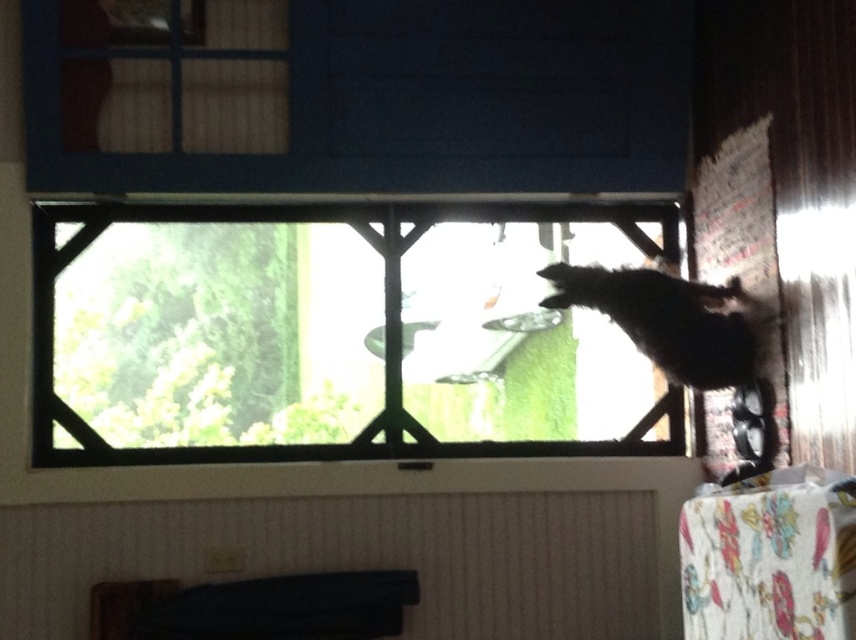
You are an interior designer assessing the space through the window. You notice the black fabric at lower center and the white paper at right. Which object takes up more area in the scene?

The white paper at right takes up more area than the black fabric at lower center.

You are an interior designer assessing the room layout. You need to determine if the black fabric at lower center can be placed under the clear glass window at center without blocking the view. Based on their sizes, can it be done?

The clear glass window at center is taller than black fabric at lower center, so placing the black fabric at lower center under the window would not block the entire view since the window extends beyond the fabric in height.

You are an interior designer arranging items on a wall. You have a clear glass window at center and a white paper at right. Which item should you place higher up on the wall to ensure they don not block each other?

The clear glass window at center is shorter than the white paper at right, so you should place the white paper at right higher up to avoid blocking the view through the window.